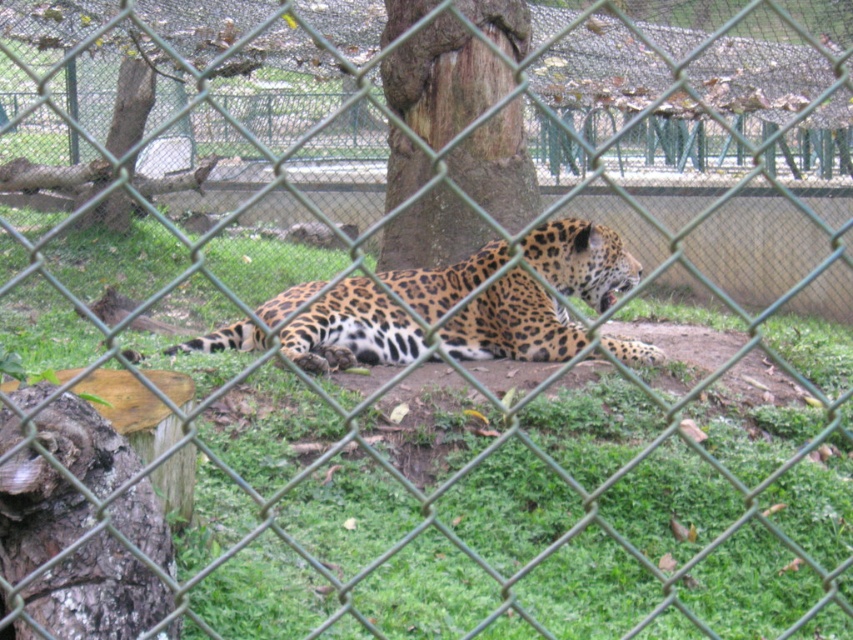
Question: Does spotted fur jaguar at center appear on the left side of brown rough bark at center?

Choices:
 (A) no
 (B) yes

Answer: (B)

Question: From the image, what is the correct spatial relationship of spotted fur jaguar at center in relation to brown rough bark at center?

Choices:
 (A) right
 (B) left

Answer: (B)

Question: Is spotted fur jaguar at center wider than brown rough bark at center?

Choices:
 (A) yes
 (B) no

Answer: (A)

Question: Which of the following is the closest to the observer?

Choices:
 (A) (509, 337)
 (B) (413, 70)

Answer: (A)